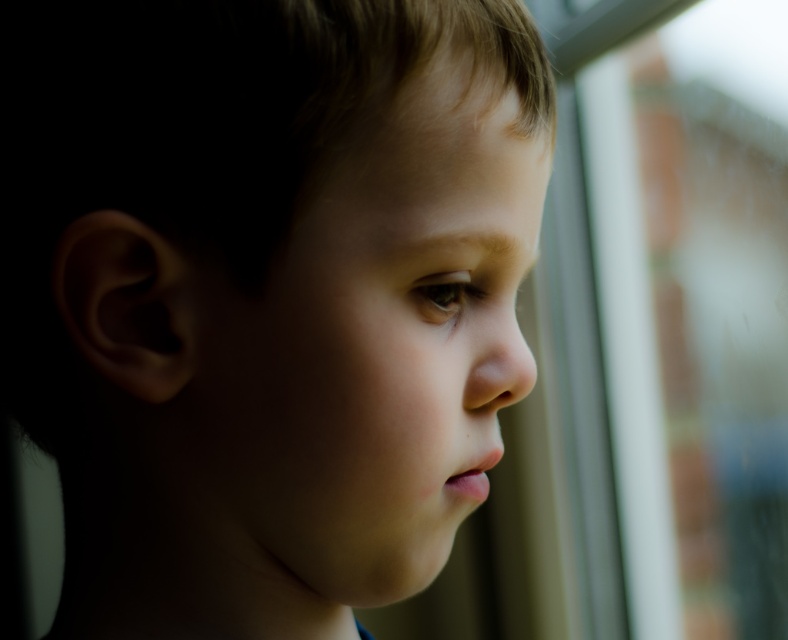
Is smooth skin child at upper center shorter than transparent glass window at right?

Yes, smooth skin child at upper center is shorter than transparent glass window at right.

Who is more forward, (277,141) or (697,61)?

Point (277,141) is in front.

You are a GUI agent. You are given a task and a screenshot of the screen. Output one action in this format:
    pyautogui.click(x=<x>, y=<y>)
    Task: Click on the smooth skin child at upper center
    
    Given the screenshot: What is the action you would take?
    pyautogui.click(x=266, y=294)